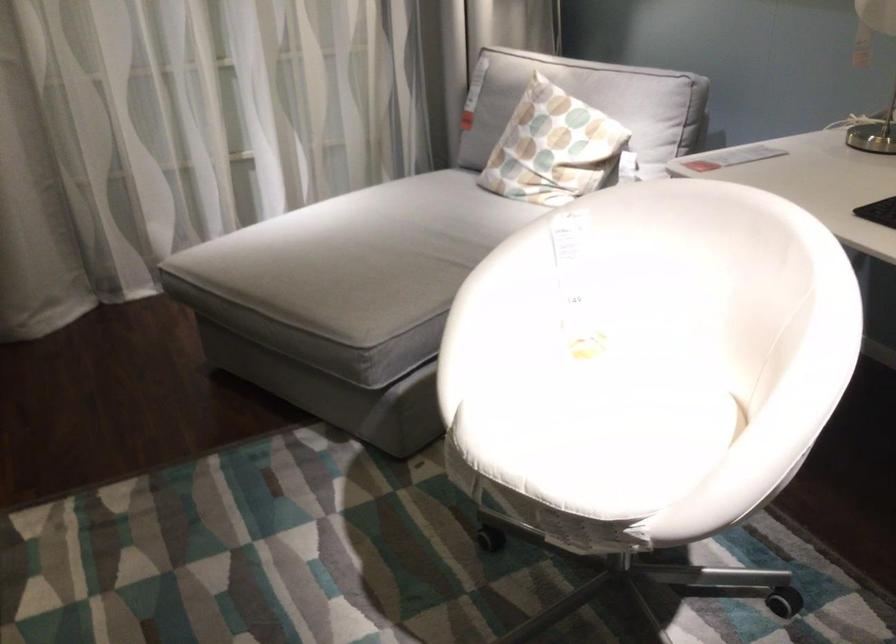
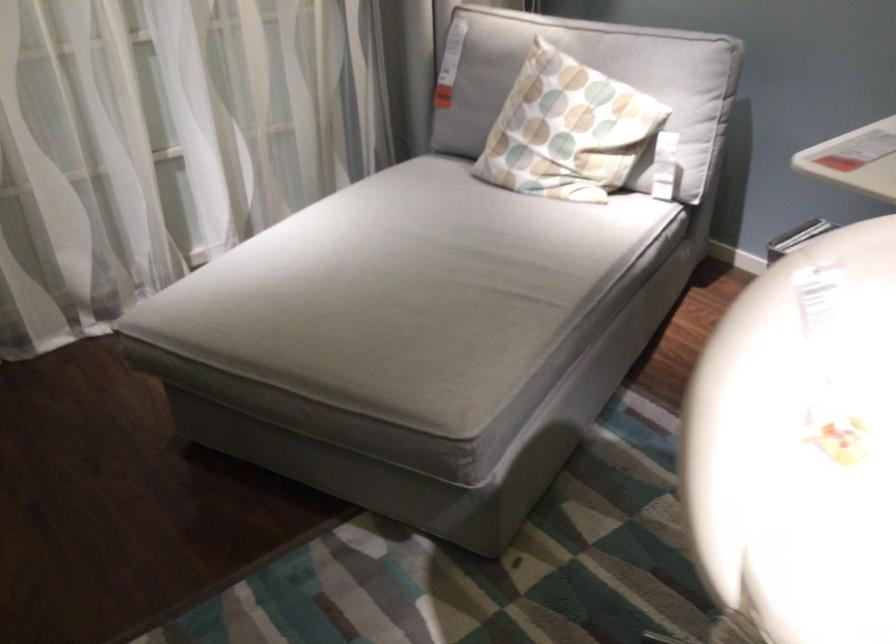
The images are taken continuously from a first-person perspective. In which direction are you moving?

The cameraman walked toward left, forward.